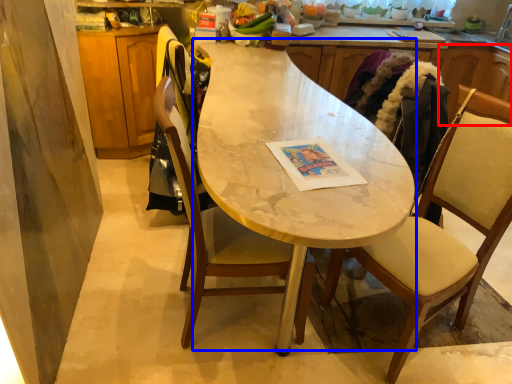
Question: Which object appears farthest to the camera in this image, cabinetry (highlighted by a red box) or round table (highlighted by a blue box)?

Choices:
 (A) cabinetry
 (B) round table

Answer: (A)